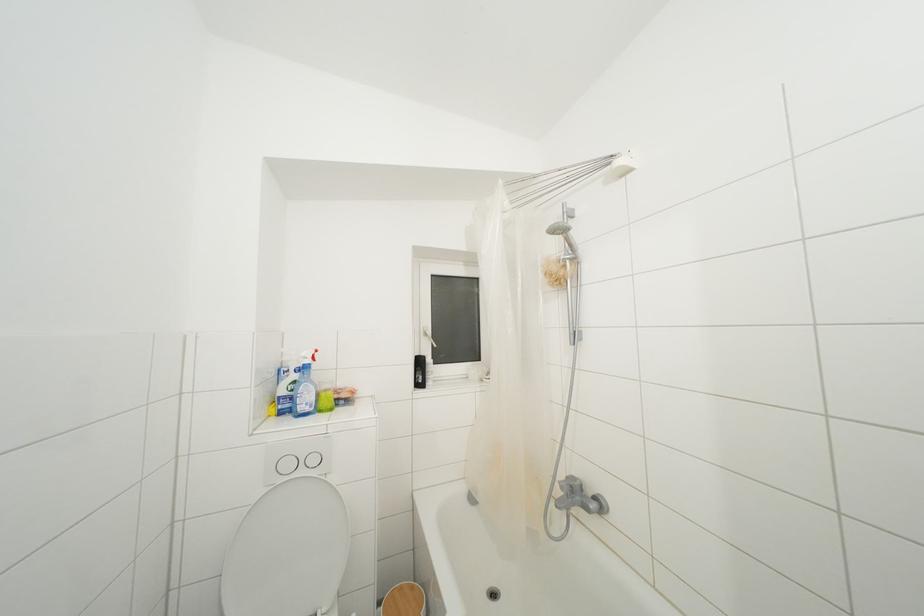
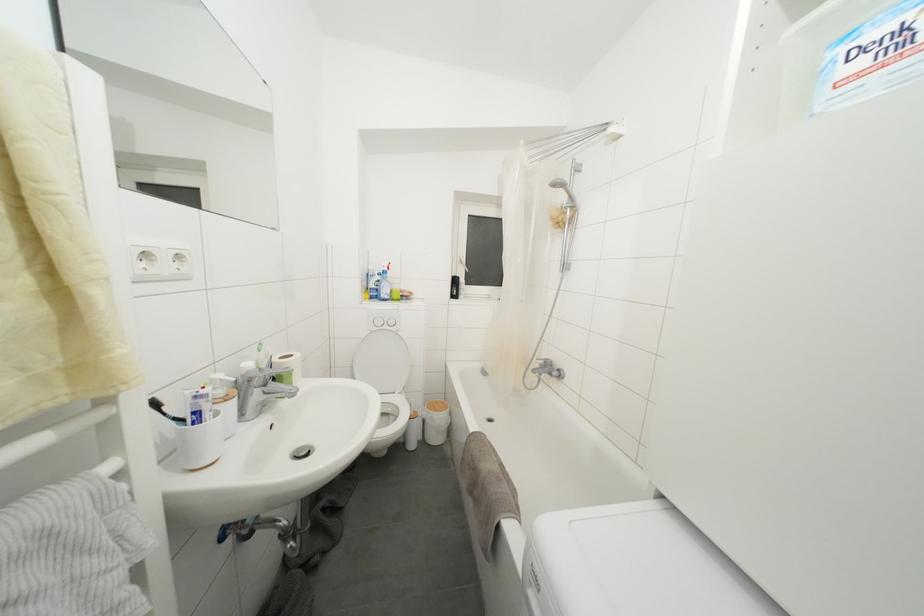
Question: The images are taken continuously from a first-person perspective. In which direction are you moving?

Choices:
 (A) Left
 (B) Right
 (C) Forward
 (D) Backward

Answer: (D)